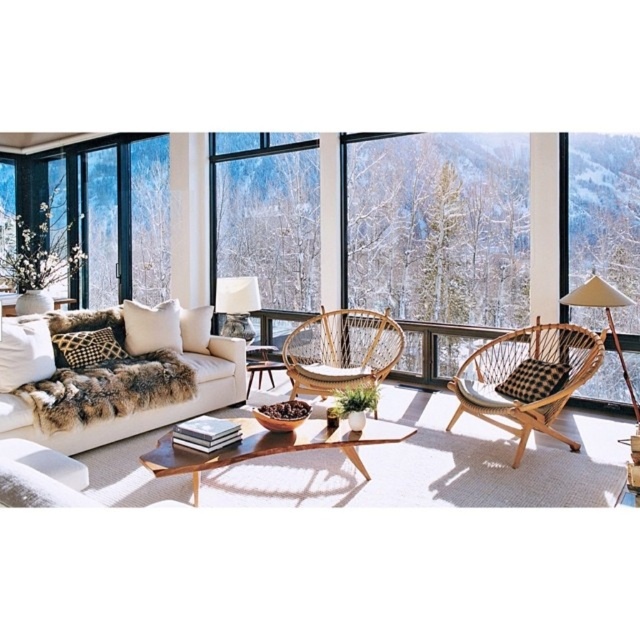
What is the spatial relationship between the clear glass window at center and the light brown wood coffee table at center in the living room?

The clear glass window at center is positioned to the left of the light brown wood coffee table at center.

You are sitting on the sofa and want to pick up a remote control placed on the light brown wood coffee table at center. To reach it, you need to move your hand past the clear glass window at center. Is the coffee table closer to you than the window?

The clear glass window at center is further to the viewer than light brown wood coffee table at center, so the coffee table is closer. You can reach the remote control without moving your hand past the window.

You are standing in the living room and see two points marked in the image. Which point, point (289, 173) or point (320, 384), is closer to you?

Point (289, 173) is further to the camera than point (320, 384), so point (320, 384) is closer to you.